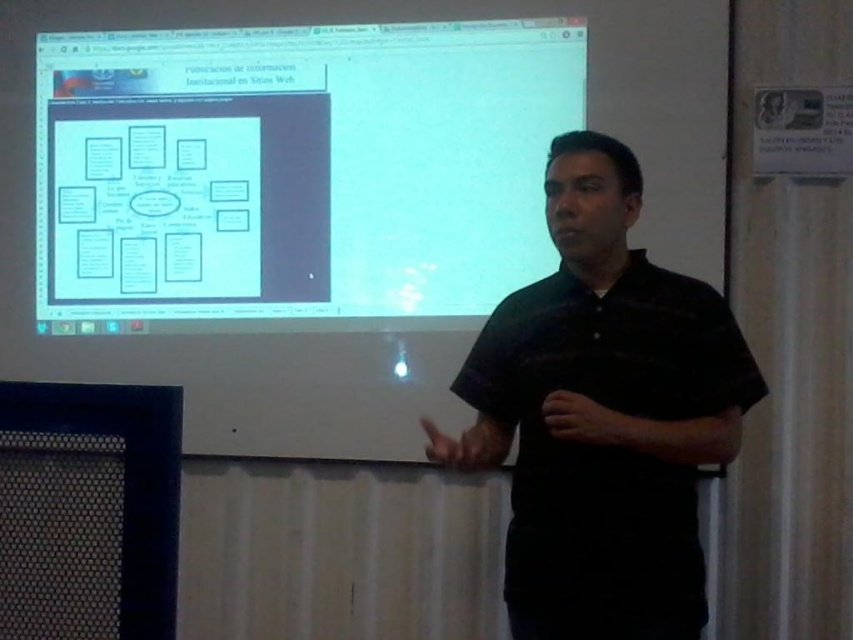
You are an attendee at the presentation. You need to take a photo of the slide on the white matte projection screen at upper center and the black striped shirt at center. Which one will be easier to capture clearly in your photo?

The white matte projection screen at upper center is bigger than the black striped shirt at center, so it will be easier to capture clearly in your photo.

You are an attendee at this presentation and want to take a photo of the slide on the white matte projection screen at upper center. However, the presenter is standing in front of it wearing the black striped shirt at center. Based on their positions, will the presenter block your view of the slide?

The white matte projection screen at upper center is positioned on the left side of the black striped shirt at center, so the presenter wearing the black striped shirt at center is standing to the right of the screen. This means the presenter is not directly in front of the screen and therefore should not block your view of the slide.